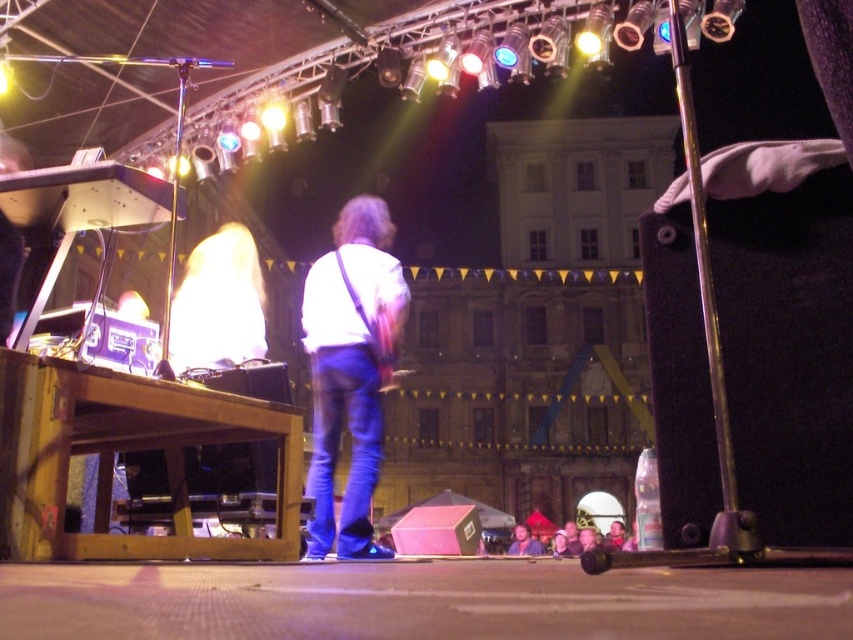
Which is more to the right, smooth skin face at lower center or smooth skin face at center?

From the viewer's perspective, smooth skin face at lower center appears more on the right side.

Is smooth skin face at lower center behind smooth skin face at center?

Yes, smooth skin face at lower center is further from the viewer.

Who is more distant from viewer, (622,540) or (576,548)?

The point (622,540) is behind.

I want to click on smooth skin face at lower center, so click(x=614, y=536).

Is smooth brown leather jacket at center thinner than smooth pink fabric at lower center?

No.

Which is more to the left, smooth brown leather jacket at center or smooth pink fabric at lower center?

smooth brown leather jacket at center

Does point (537, 541) lie behind point (572, 547)?

Yes, it is.

Find the location of a particular element. smooth brown leather jacket at center is located at coordinates (524, 541).

Consider the image. Is white matte shirt at center shorter than smooth skin face at center?

In fact, white matte shirt at center may be taller than smooth skin face at center.

Who is more distant from viewer, [352,282] or [567,536]?

The point [567,536] is more distant.

The width and height of the screenshot is (853, 640). I want to click on white matte shirt at center, so click(x=350, y=369).

The height and width of the screenshot is (640, 853). In order to click on white matte shirt at center in this screenshot , I will do `click(350, 369)`.